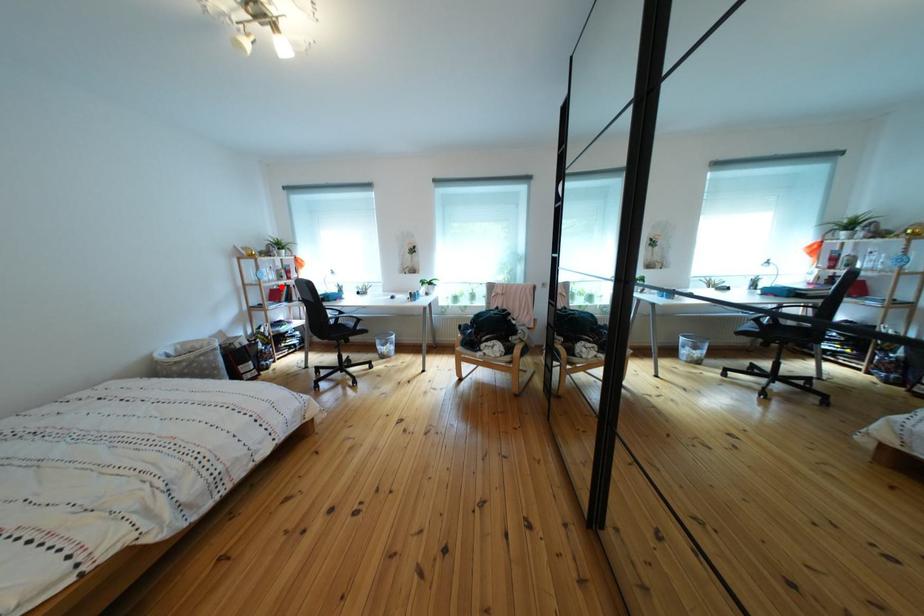
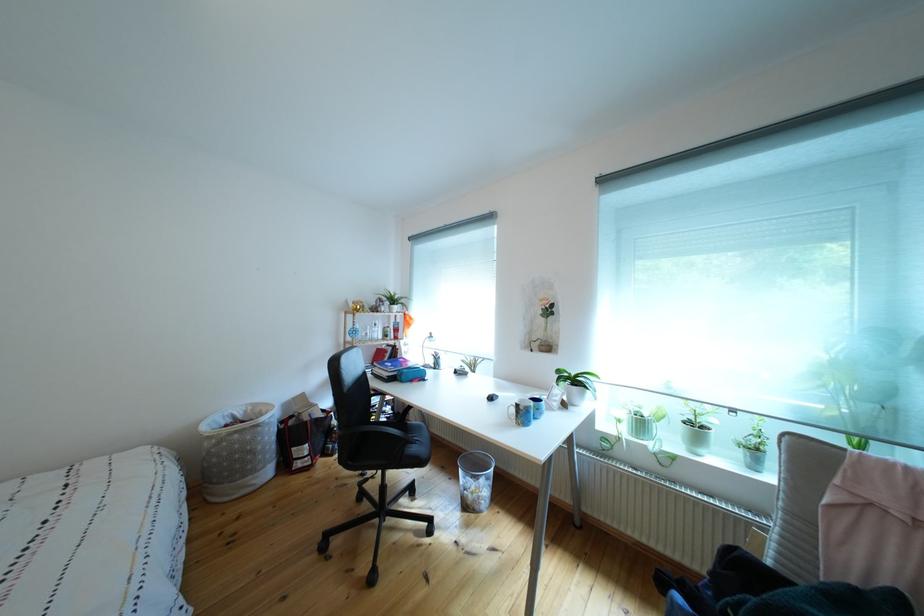
The point at the highlighted location is marked in the first image. Where is the corresponding point in the second image?

(383, 345)